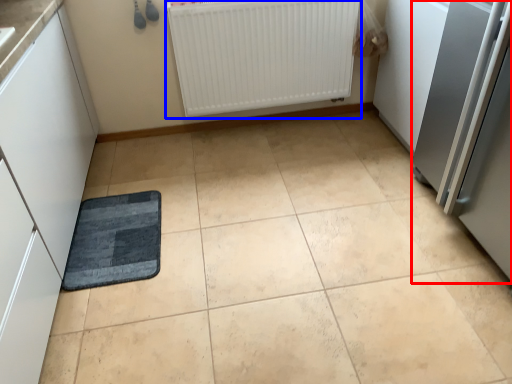
Question: Which of the following is the farthest to the observer, appliance (highlighted by a red box) or radiator (highlighted by a blue box)?

Choices:
 (A) appliance
 (B) radiator

Answer: (B)